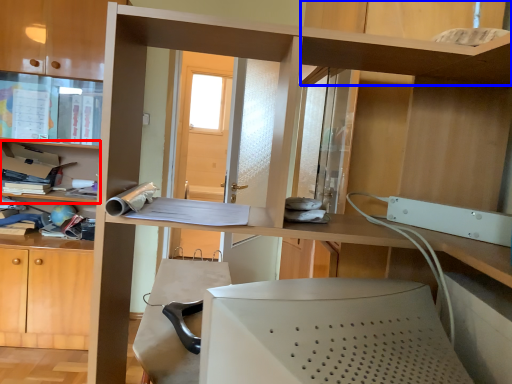
Question: Among these objects, which one is nearest to the camera, shelf (highlighted by a red box) or shelf (highlighted by a blue box)?

Choices:
 (A) shelf
 (B) shelf

Answer: (B)